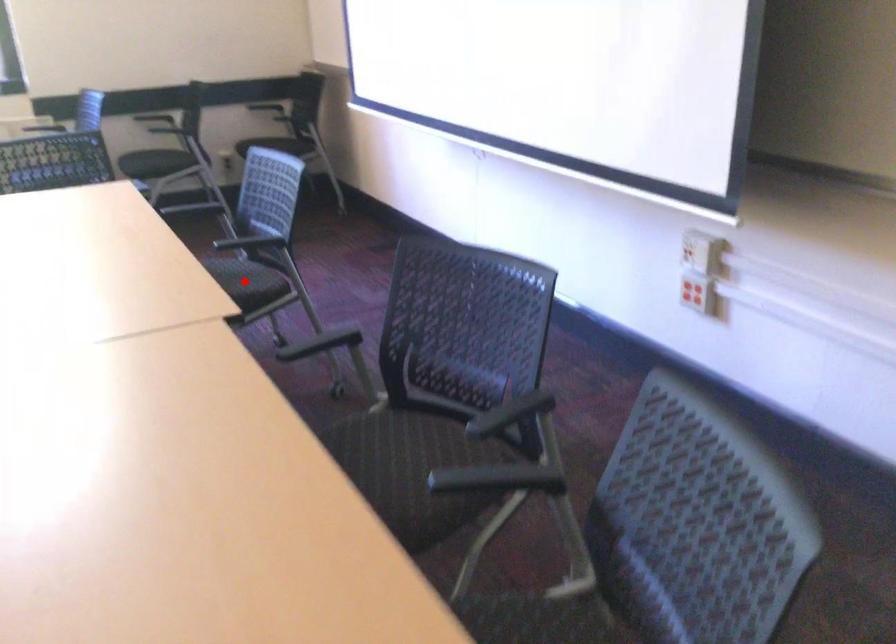
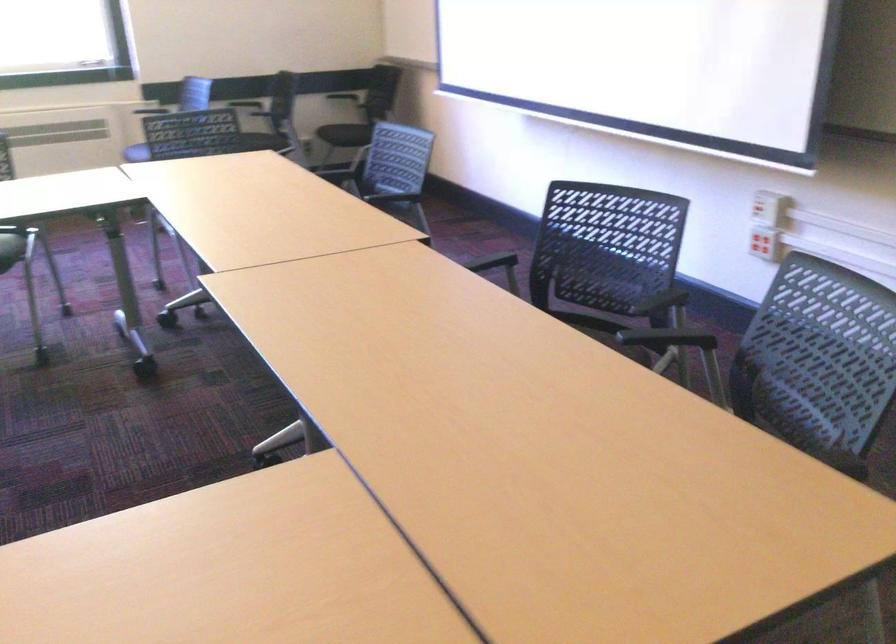
Question: I am providing you with two images of the same scene from different viewpoints. A red point is marked on the first image. Can you still see the location of the red point in image 2?

Choices:
 (A) Yes
 (B) No

Answer: (B)